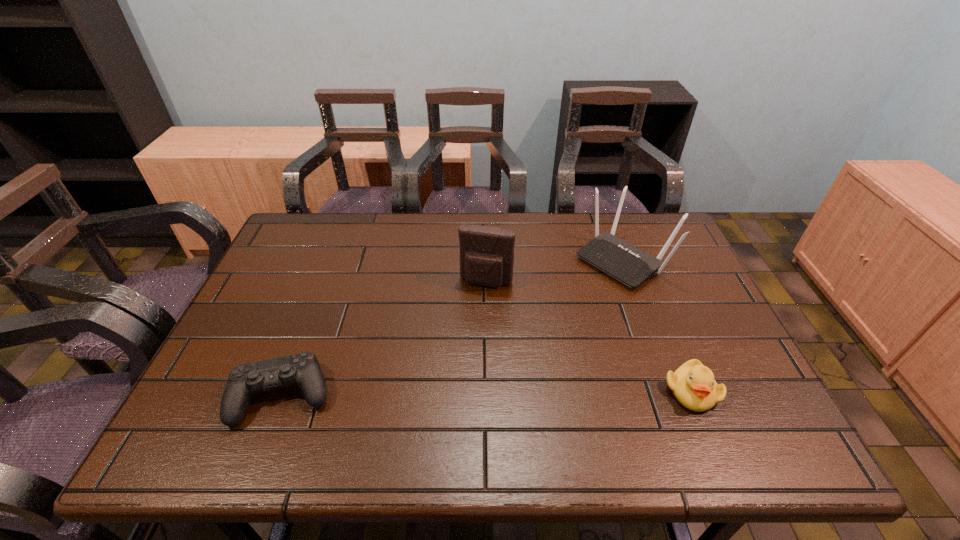
Where is `vacant space located 0.060m with an open flap on the second object from left to right`? The image size is (960, 540). vacant space located 0.060m with an open flap on the second object from left to right is located at coordinates (477, 306).

At what (x,y) coordinates should I click in order to perform the action: click on object that is at the far edge. Please return your answer as a coordinate pair (x, y). The height and width of the screenshot is (540, 960). Looking at the image, I should click on (630, 265).

This screenshot has width=960, height=540. What are the coordinates of `control present at the near edge` in the screenshot? It's located at (303, 369).

You are a GUI agent. You are given a task and a screenshot of the screen. Output one action in this format:
    pyautogui.click(x=<x>, y=<y>)
    Task: Click on the duckling that is positioned at the near edge
    The image size is (960, 540).
    Given the screenshot: What is the action you would take?
    pyautogui.click(x=693, y=384)

Locate an element on the screen. object located at the left edge is located at coordinates (303, 369).

Locate an element on the screen. This screenshot has height=540, width=960. duckling that is positioned at the right edge is located at coordinates (693, 384).

This screenshot has height=540, width=960. I want to click on router that is at the right edge, so click(x=630, y=265).

This screenshot has height=540, width=960. Identify the location of object present at the near left corner. (303, 369).

The height and width of the screenshot is (540, 960). In order to click on object that is at the far right corner in this screenshot , I will do (x=630, y=265).

Where is `object that is positioned at the near right corner`? The height and width of the screenshot is (540, 960). object that is positioned at the near right corner is located at coordinates (693, 384).